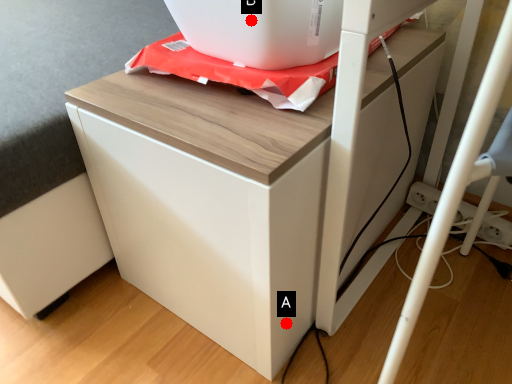
Question: Two points are circled on the image, labeled by A and B beside each circle. Which point is closer to the camera taking this photo?

Choices:
 (A) A is closer
 (B) B is closer

Answer: (B)